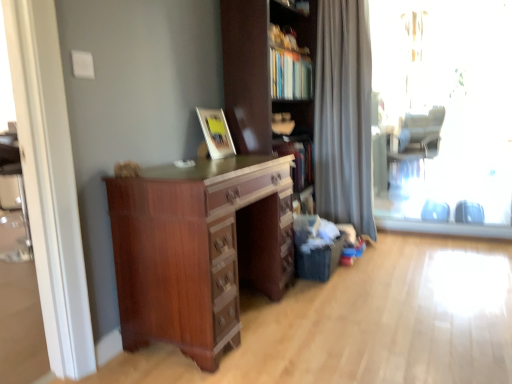
Question: Is gray fabric swivel chair at right inside the boundaries of matte wooden picture frame at upper center, or outside?

Choices:
 (A) outside
 (B) inside

Answer: (A)

Question: From the image's perspective, is gray fabric swivel chair at right above or below matte wooden picture frame at upper center?

Choices:
 (A) above
 (B) below

Answer: (A)

Question: Which object is the closest to the silky gray curtain at right?

Choices:
 (A) matte wooden picture frame at upper center
 (B) transparent glass window at right
 (C) matte brown cupboard at center
 (D) gray fabric swivel chair at right
 (E) mahogany wood chest of drawers at center

Answer: (C)

Question: Which is farther from the silky gray curtain at right?

Choices:
 (A) matte wooden picture frame at upper center
 (B) mahogany wood chest of drawers at center
 (C) transparent glass window at right
 (D) gray fabric swivel chair at right
 (E) matte brown cupboard at center

Answer: (D)